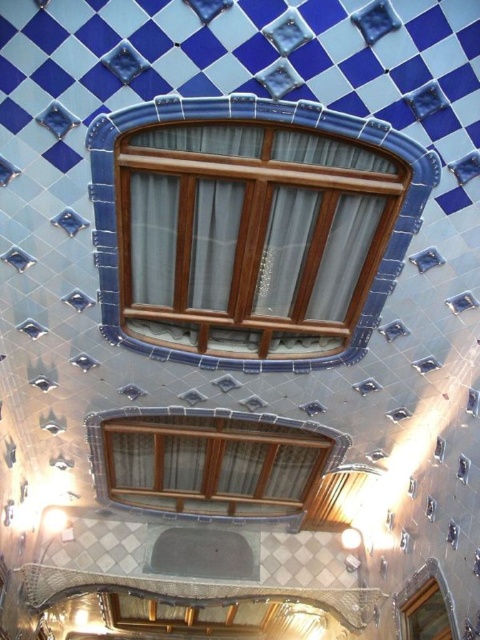
You are an architect examining the interior architectural detail. You notice two points marked in the scene. Which point is closer to you, point (355, 156) or point (276, 481)?

Point (355, 156) is closer to the viewer than point (276, 481).

You are an interior designer assessing the space between the wooden frame at center and the matte wood window at center. Which object is taller?

The wooden frame at center is taller than the matte wood window at center.

You are an interior designer planning to install a new light fixture between the wooden frame at center and the matte wood window at center. The fixture requires a minimum of 3 meters of space between the two points. Can the space accommodate this requirement?

The wooden frame at center and the matte wood window at center are 3.77 meters apart, which exceeds the required 3 meters, so the space can accommodate the new light fixture.